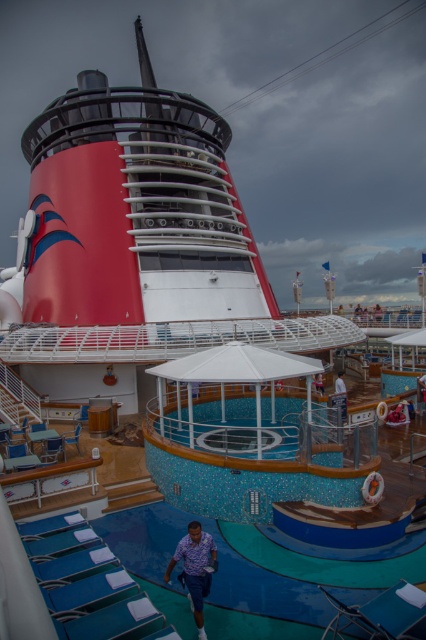
Does point (204, 532) come closer to viewer compared to point (423, 394)?

That is True.

Which is in front, point (189, 545) or point (417, 388)?

Point (189, 545)

The height and width of the screenshot is (640, 426). I want to click on printed cotton shirt at lower center, so click(x=195, y=568).

Who is positioned more to the left, blue fabric shorts at lower center or white fabric umbrella at upper center?

white fabric umbrella at upper center

Which of these two, blue fabric shorts at lower center or white fabric umbrella at upper center, stands taller?

Standing taller between the two is white fabric umbrella at upper center.

Does point (420, 387) lie behind point (313, 378)?

That is False.

Identify the location of blue fabric shorts at lower center. (422, 388).

How far apart are blue mosaic tiles at center and printed cotton shirt at lower center?

The distance of blue mosaic tiles at center from printed cotton shirt at lower center is 7.27 feet.

Who is shorter, blue mosaic tiles at center or printed cotton shirt at lower center?

With less height is blue mosaic tiles at center.

Is point (328, 580) closer to camera compared to point (189, 600)?

No, it is not.

Locate an element on the screen. This screenshot has width=426, height=640. blue mosaic tiles at center is located at coordinates (273, 588).